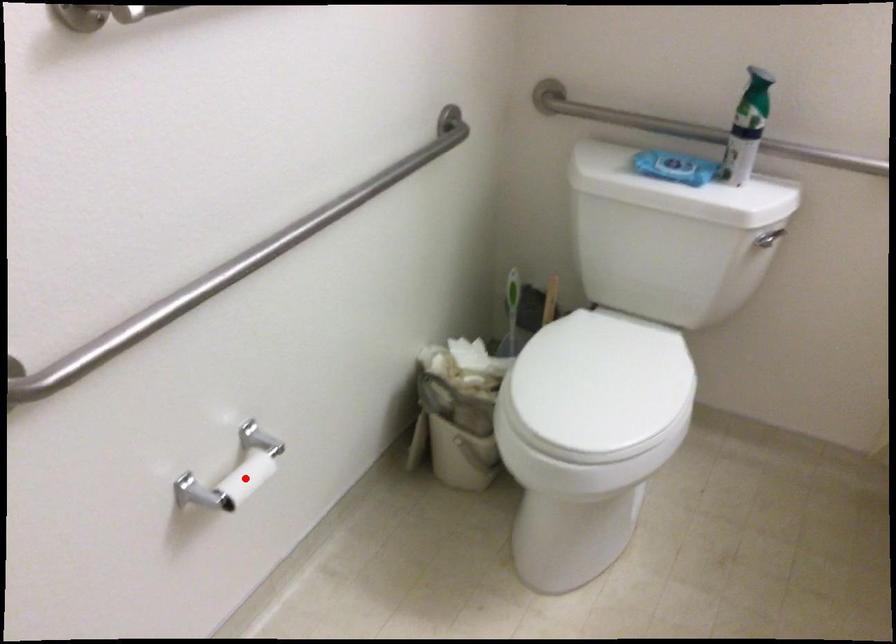
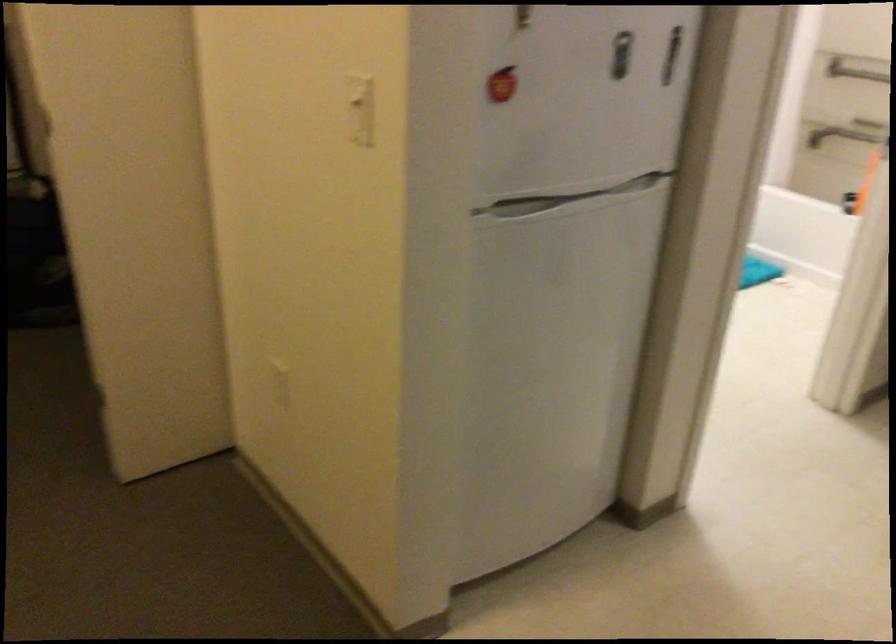
Question: I am providing you with two images of the same scene from different viewpoints. A red point is marked on the first image. Can you still see the location of the red point in image 2?

Choices:
 (A) Yes
 (B) No

Answer: (B)